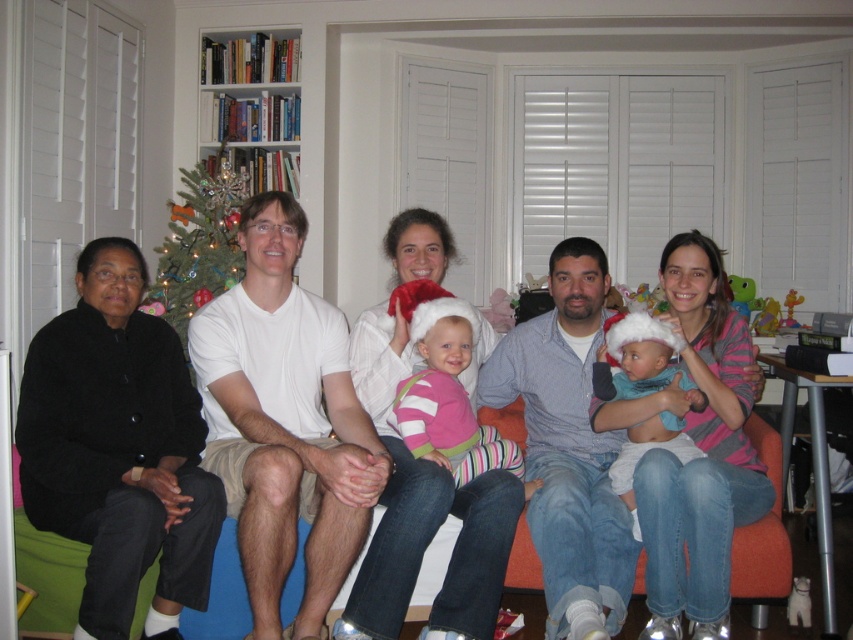
Question: Is black sweater at left smaller than pink striped sweater at center?

Choices:
 (A) no
 (B) yes

Answer: (A)

Question: Which object is the farthest from the green artificial christmas tree at upper left?

Choices:
 (A) turquoise soft fabric baby at center
 (B) black sweater at left

Answer: (A)

Question: From the image, what is the correct spatial relationship of pink striped sweater at center in relation to green artificial christmas tree at upper left?

Choices:
 (A) left
 (B) right

Answer: (B)

Question: Where is black sweater at left located in relation to green artificial christmas tree at upper left in the image?

Choices:
 (A) below
 (B) above

Answer: (A)

Question: Which of these objects is positioned closest to the green artificial christmas tree at upper left?

Choices:
 (A) black sweater at left
 (B) turquoise soft fabric baby at center

Answer: (A)

Question: Which object is farther from the camera taking this photo?

Choices:
 (A) pink striped sweater at center
 (B) black sweater at left
 (C) green artificial christmas tree at upper left
 (D) turquoise soft fabric baby at center

Answer: (C)